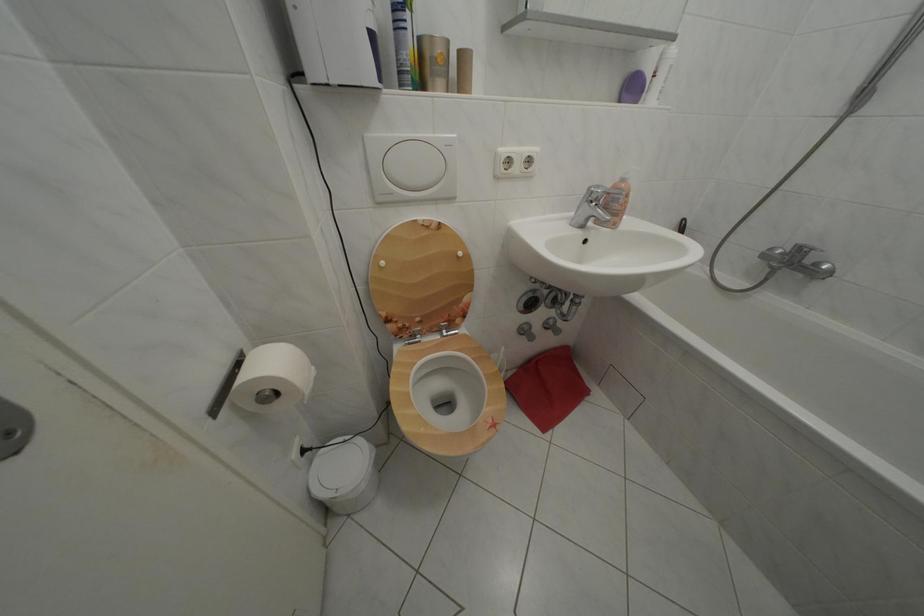
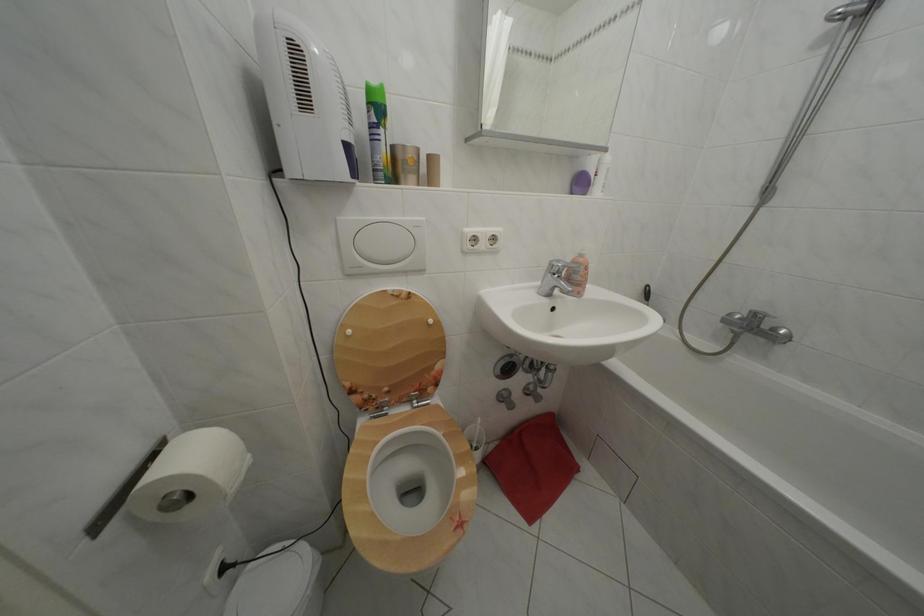
The point at (286, 400) is marked in the first image. Where is the corresponding point in the second image?

(198, 504)